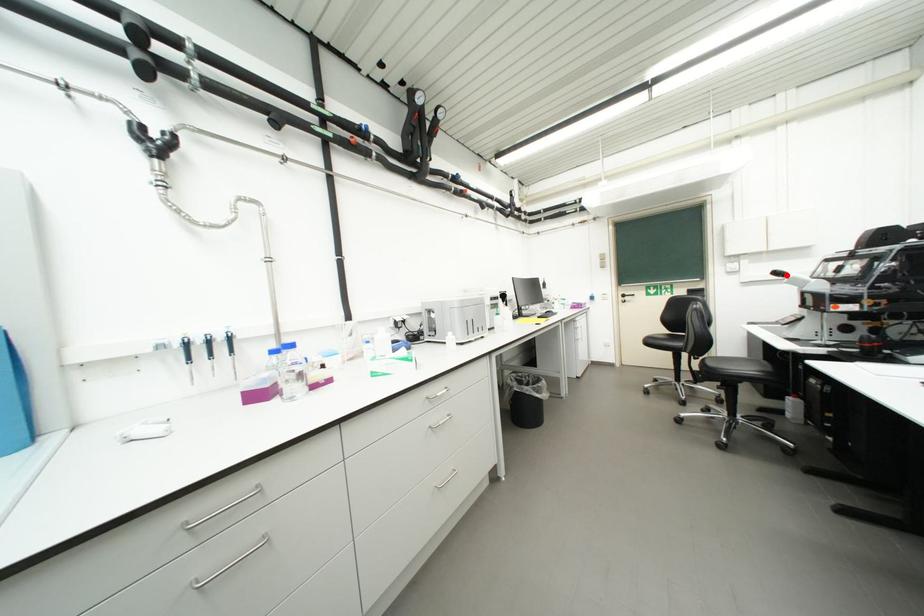
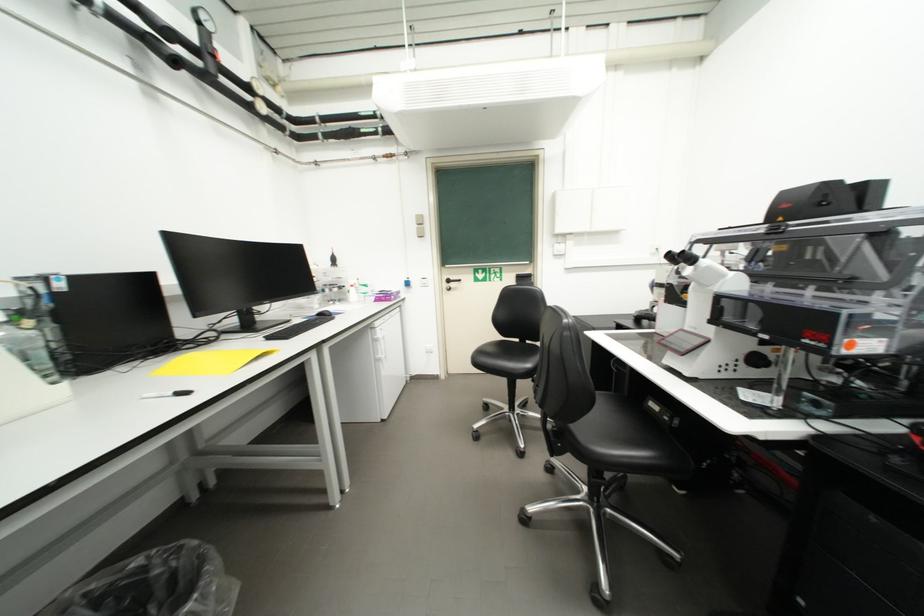
The point at the highlighted location is marked in the first image. Where is the corresponding point in the second image?

(687, 259)